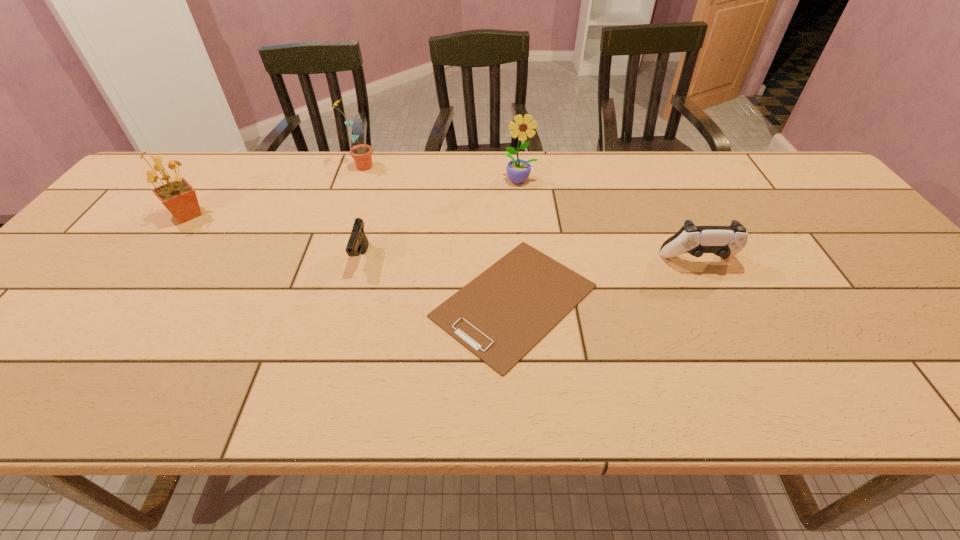
Identify the location of vacant space at the right edge of the desktop. The height and width of the screenshot is (540, 960). (815, 208).

At what (x,y) coordinates should I click in order to perform the action: click on blank space at the far right corner of the desktop. Please return your answer as a coordinate pair (x, y). Looking at the image, I should click on (787, 161).

Find the location of `blank region between the second shortest object and the shortest object`. blank region between the second shortest object and the shortest object is located at coordinates (438, 279).

Locate an element on the screen. empty space that is in between the rightmost sunflower and the nearest sunflower is located at coordinates (354, 198).

Find the location of a particular element. vacant region between the rightmost sunflower and the control is located at coordinates (609, 221).

Where is `free area in between the rightmost sunflower and the third farthest object`? This screenshot has height=540, width=960. free area in between the rightmost sunflower and the third farthest object is located at coordinates (354, 198).

Locate an element on the screen. This screenshot has height=540, width=960. vacant space in between the shortest object and the rightmost sunflower is located at coordinates (517, 241).

You are a GUI agent. You are given a task and a screenshot of the screen. Output one action in this format:
    pyautogui.click(x=<x>, y=<y>)
    Task: Click on the free spot between the clipboard and the second object from left to right
    Image resolution: width=960 pixels, height=540 pixels.
    Given the screenshot: What is the action you would take?
    pyautogui.click(x=436, y=234)

You are a GUI agent. You are given a task and a screenshot of the screen. Output one action in this format:
    pyautogui.click(x=<x>, y=<y>)
    Task: Click on the free space between the rightmost sunflower and the shortest object
    This screenshot has width=960, height=540.
    Given the screenshot: What is the action you would take?
    pyautogui.click(x=517, y=241)

The width and height of the screenshot is (960, 540). I want to click on empty location between the third farthest object and the rightmost sunflower, so pyautogui.click(x=354, y=198).